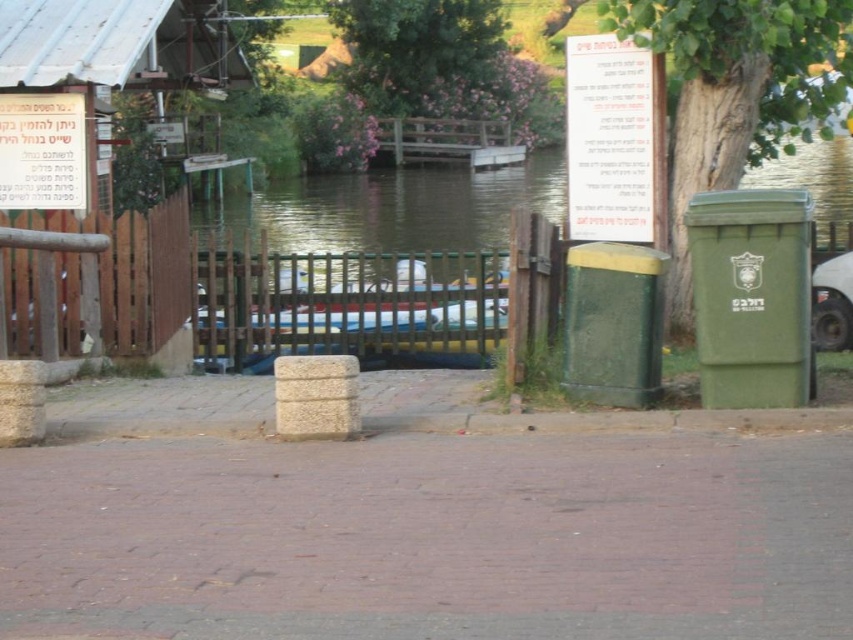
Does green wooden fence at center have a larger size compared to brown wooden fence at left?

Correct, green wooden fence at center is larger in size than brown wooden fence at left.

Is green wooden fence at center to the right of brown wooden fence at left from the viewer's perspective?

→ Indeed, green wooden fence at center is positioned on the right side of brown wooden fence at left.

Which is behind, point (279, 332) or point (77, 305)?

The point (279, 332) is behind.

Locate an element on the screen. This screenshot has height=640, width=853. green wooden fence at center is located at coordinates (347, 305).

Is wooden sign at left closer to the viewer compared to brown wooden fence at left?

No, it is not.

Which is behind, point (218, 4) or point (67, 301)?

The point (218, 4) is behind.

Is point (115, 29) farther from camera compared to point (148, 266)?

Yes, it is behind point (148, 266).

Locate an element on the screen. Image resolution: width=853 pixels, height=640 pixels. wooden sign at left is located at coordinates (108, 141).

How much distance is there between green textured bin at center and green wooden fence at center?

green textured bin at center and green wooden fence at center are 3.97 meters apart from each other.

Can you confirm if green textured bin at center is smaller than green wooden fence at center?

No, green textured bin at center is not smaller than green wooden fence at center.

Does point (724, 156) come behind point (415, 298)?

That is False.

You are a GUI agent. You are given a task and a screenshot of the screen. Output one action in this format:
    pyautogui.click(x=<x>, y=<y>)
    Task: Click on the green textured bin at center
    Image resolution: width=853 pixels, height=640 pixels.
    Given the screenshot: What is the action you would take?
    click(x=737, y=92)